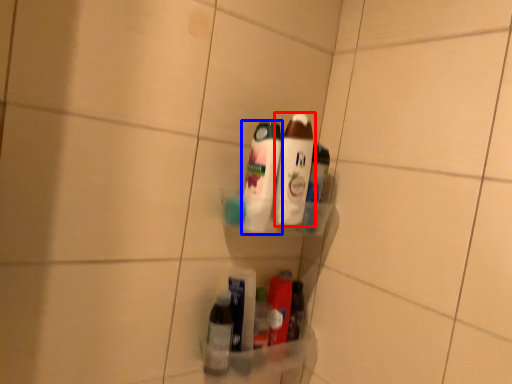
Question: Which object is further to the camera taking this photo, bottle (highlighted by a red box) or bottle (highlighted by a blue box)?

Choices:
 (A) bottle
 (B) bottle

Answer: (A)